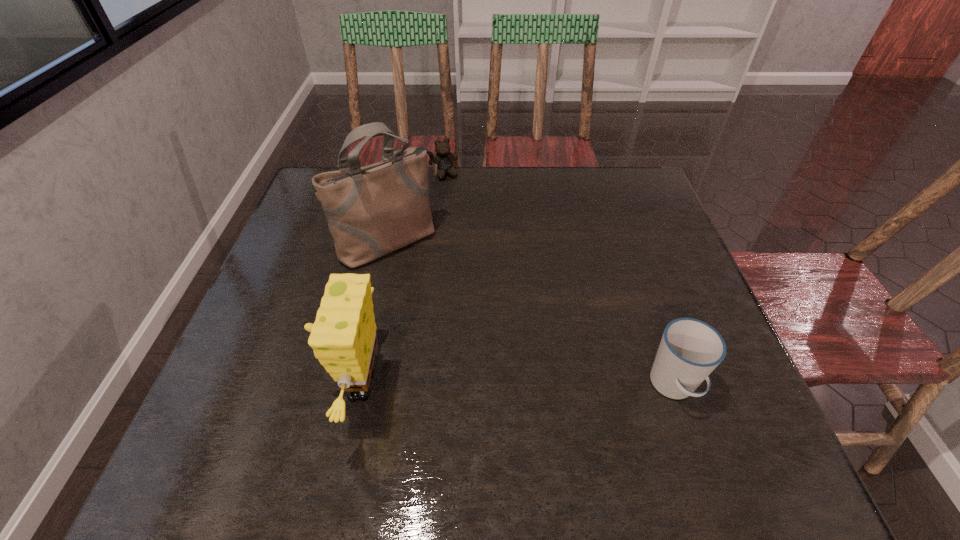
The image size is (960, 540). I want to click on vacant space located on the face of the teddy bear, so click(492, 263).

Identify the location of free location located 0.250m on the face of the teddy bear. Image resolution: width=960 pixels, height=540 pixels. (475, 231).

This screenshot has height=540, width=960. Identify the location of vacant space located 0.220m on the face of the teddy bear. (471, 225).

You are a GUI agent. You are given a task and a screenshot of the screen. Output one action in this format:
    pyautogui.click(x=<x>, y=<y>)
    Task: Click on the vacant area situated on the front-facing side of the tallest object
    
    Given the screenshot: What is the action you would take?
    pyautogui.click(x=432, y=281)

Locate an element on the screen. Image resolution: width=960 pixels, height=540 pixels. free location located on the front-facing side of the tallest object is located at coordinates (444, 293).

Find the location of a particular element. The width and height of the screenshot is (960, 540). free space located on the front-facing side of the tallest object is located at coordinates (483, 335).

Find the location of a particular element. The width and height of the screenshot is (960, 540). object that is at the far edge is located at coordinates (444, 158).

Locate an element on the screen. sponge that is at the near edge is located at coordinates (343, 337).

This screenshot has width=960, height=540. I want to click on cup that is positioned at the near edge, so click(690, 349).

The height and width of the screenshot is (540, 960). Find the location of `object situated at the left edge`. object situated at the left edge is located at coordinates (373, 210).